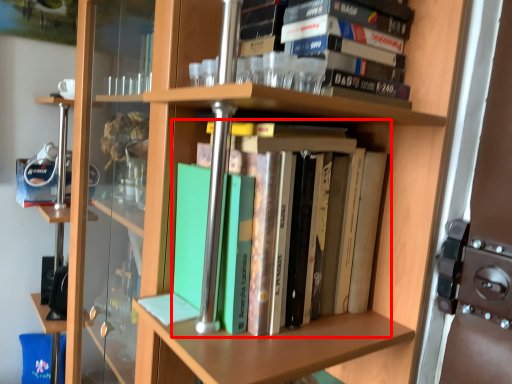
Question: Where is book (annotated by the red box) located in relation to book in the image?

Choices:
 (A) left
 (B) right

Answer: (A)